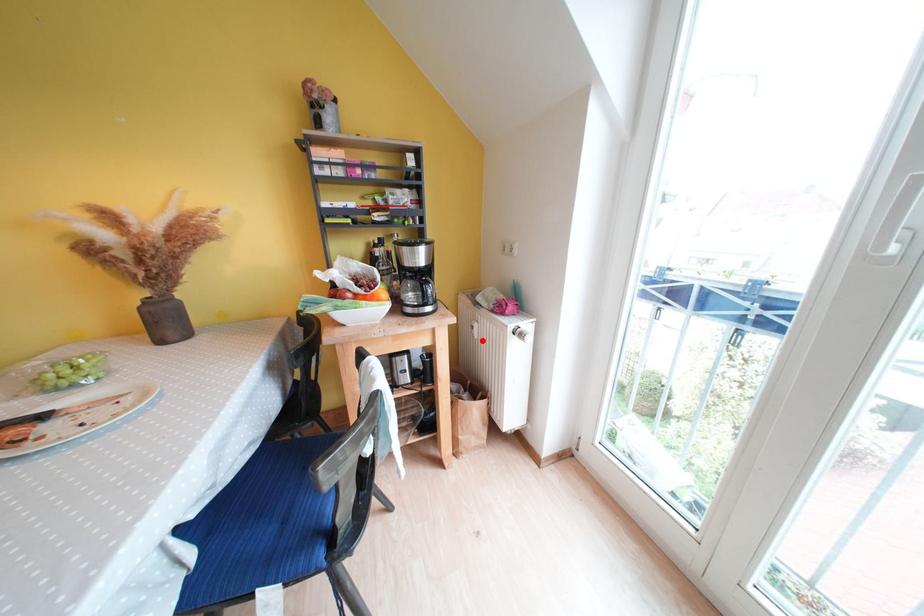
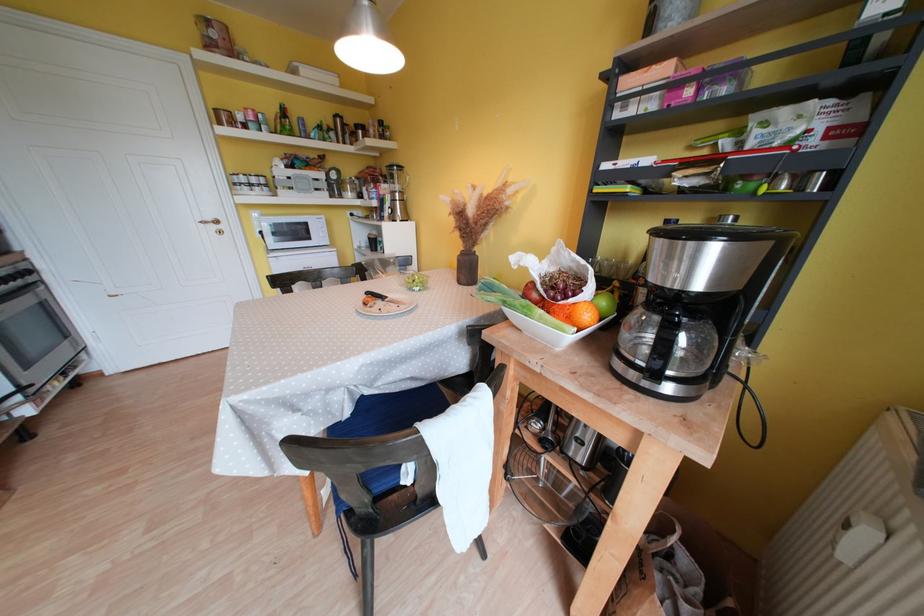
Where in the second image is the point corresponding to the highlighted location from the first image?

(850, 562)